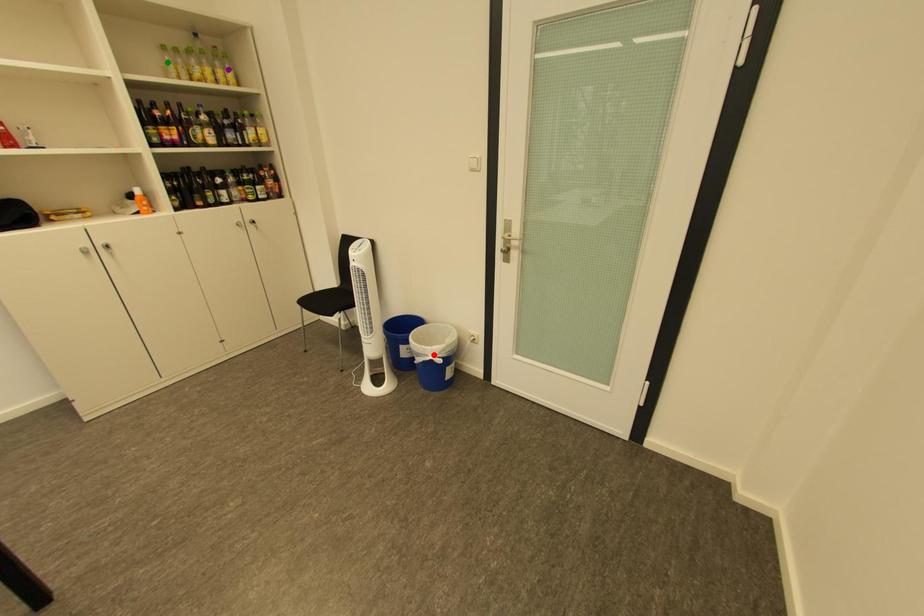
Order these from farthest to nearest:
purple point
red point
green point

1. purple point
2. red point
3. green point